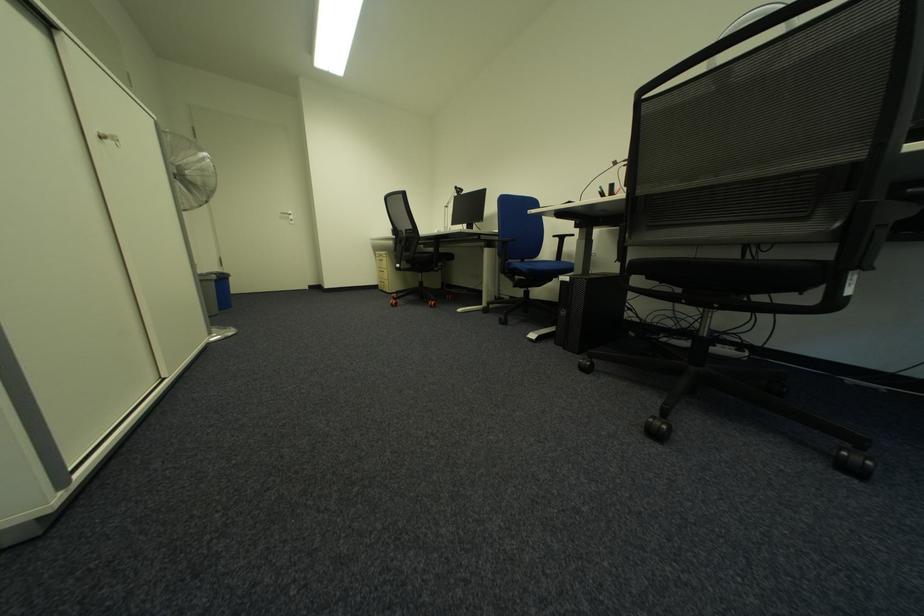
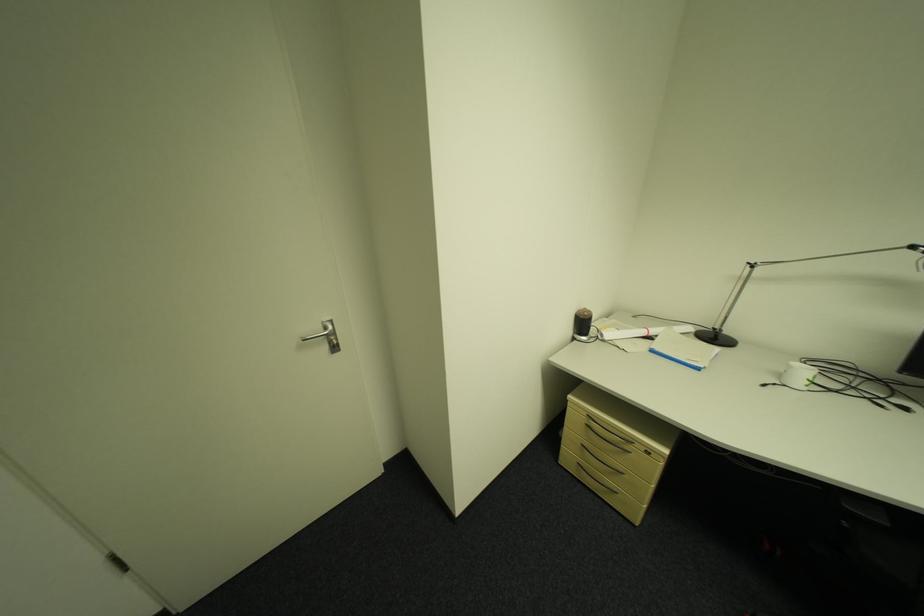
The images are taken continuously from a first-person perspective. In which direction are you moving?

The movement direction of the cameraman is left, forward.